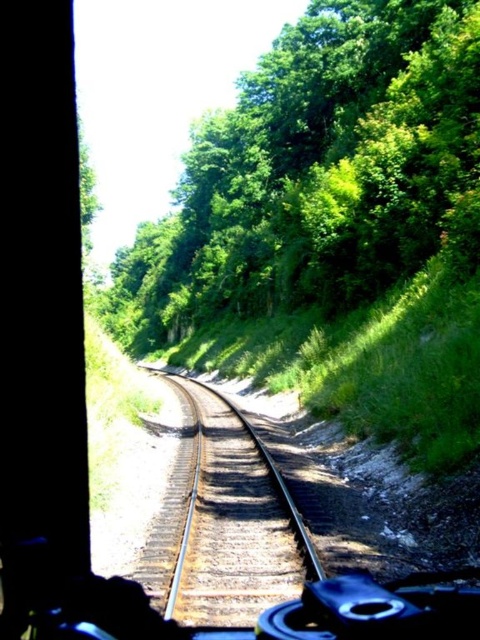
You are a passenger in a car and looking out the window. You notice green leafy trees at upper center. Can you tell me the coordinates of their position?

The green leafy trees at upper center are located at coordinates point (315, 170).

From the picture: You are driving a car and want to park between the green leafy trees at upper center. The car is 15 feet long. Can you park there?

The green leafy trees at upper center are 90.44 feet apart, so yes, the car can park between them since the distance is more than the car length.